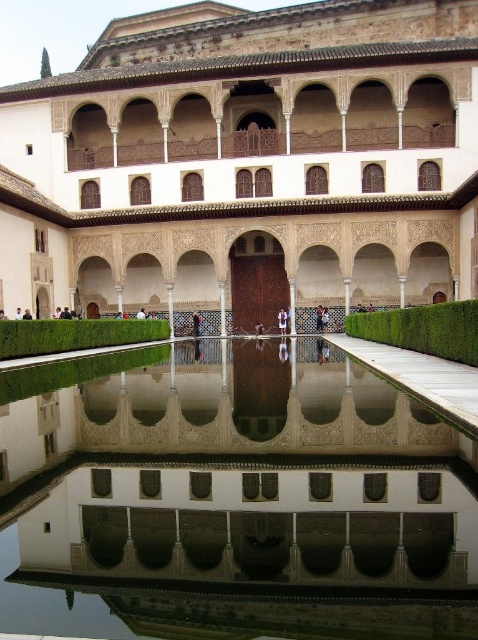
Does light brown wooden chair at center appear over light brown wooden person at center?

Actually, light brown wooden chair at center is below light brown wooden person at center.

Can you confirm if light brown wooden chair at center is positioned to the left of light brown wooden person at center?

No, light brown wooden chair at center is not to the left of light brown wooden person at center.

You are a GUI agent. You are given a task and a screenshot of the screen. Output one action in this format:
    pyautogui.click(x=<x>, y=<y>)
    Task: Click on the light brown wooden chair at center
    
    Given the screenshot: What is the action you would take?
    pyautogui.click(x=318, y=317)

Where is `light brown wooden chair at center`? light brown wooden chair at center is located at coordinates (318, 317).

Measure the distance from brown leather jacket at center to smooth brown wooden door at center.

brown leather jacket at center and smooth brown wooden door at center are 20.13 feet apart from each other.

Who is more forward, (286, 317) or (323, 324)?

Point (323, 324) is in front.

What do you see at coordinates (282, 321) in the screenshot?
I see `brown leather jacket at center` at bounding box center [282, 321].

The image size is (478, 640). I want to click on brown leather jacket at center, so click(282, 321).

Is point (289, 284) farther from viewer compared to point (0, 316)?

Yes.

Where is `white marble pillar at center`? The height and width of the screenshot is (640, 478). white marble pillar at center is located at coordinates (292, 307).

Is point (293, 284) positioned after point (0, 308)?

Yes, it is.

Image resolution: width=478 pixels, height=640 pixels. I want to click on white marble pillar at center, so click(x=292, y=307).